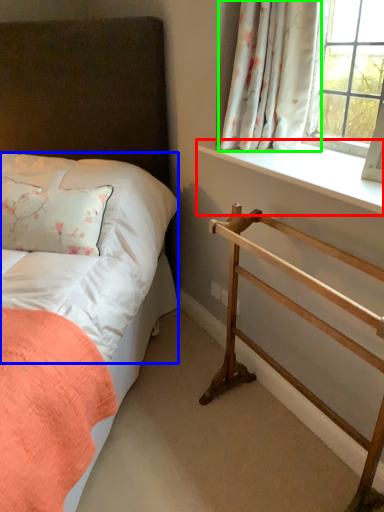
Question: Considering the real-world distances, which object is farthest from window sill (highlighted by a red box)? sheet (highlighted by a blue box) or curtain (highlighted by a green box)?

Choices:
 (A) sheet
 (B) curtain

Answer: (A)